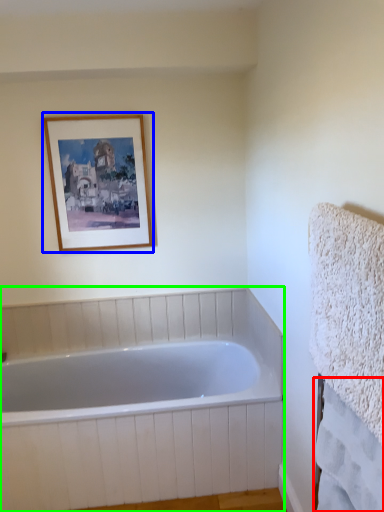
Question: Based on their relative distances, which object is farther from bath towel (highlighted by a red box)? Choose from picture frame (highlighted by a blue box) and bathtub (highlighted by a green box).

Choices:
 (A) picture frame
 (B) bathtub

Answer: (A)